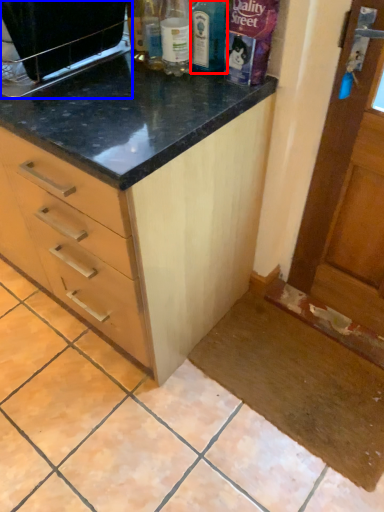
Question: Which of the following is the closest to the observer, bottle (highlighted by a red box) or appliance (highlighted by a blue box)?

Choices:
 (A) bottle
 (B) appliance

Answer: (B)